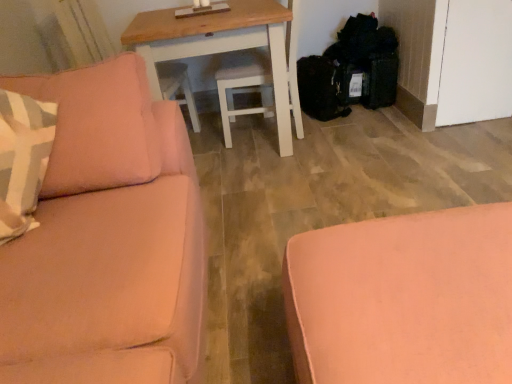
The height and width of the screenshot is (384, 512). Identify the location of satin pink couch at left, which appears as the second studio couch when viewed from the right. (106, 240).

This screenshot has width=512, height=384. Describe the element at coordinates (403, 299) in the screenshot. I see `pink fabric ottoman at lower right, acting as the second studio couch starting from the left` at that location.

Locate an element on the screen. pink fabric ottoman at lower right, acting as the second studio couch starting from the left is located at coordinates (403, 299).

What are the coordinates of `satin pink couch at left, which appears as the second studio couch when viewed from the right` in the screenshot? It's located at (106, 240).

Does pink fabric ottoman at lower right, the first studio couch from the right, have a smaller size compared to satin pink couch at left, which appears as the second studio couch when viewed from the right?

Indeed, pink fabric ottoman at lower right, the first studio couch from the right, has a smaller size compared to satin pink couch at left, which appears as the second studio couch when viewed from the right.

In the scene shown: How distant is pink fabric ottoman at lower right, acting as the second studio couch starting from the left, from satin pink couch at left, marked as the first studio couch in a left-to-right arrangement?

The distance of pink fabric ottoman at lower right, acting as the second studio couch starting from the left, from satin pink couch at left, marked as the first studio couch in a left-to-right arrangement, is 18.73 inches.

Which of these two, pink fabric ottoman at lower right, acting as the second studio couch starting from the left, or satin pink couch at left, which appears as the second studio couch when viewed from the right, stands shorter?

Standing shorter between the two is pink fabric ottoman at lower right, acting as the second studio couch starting from the left.

Image resolution: width=512 pixels, height=384 pixels. There is a pink fabric ottoman at lower right, the first studio couch from the right. Identify the location of studio couch above it (from a real-world perspective). (106, 240).

Between satin pink couch at left, marked as the first studio couch in a left-to-right arrangement, and wooden table at center, which one appears on the left side from the viewer's perspective?

satin pink couch at left, marked as the first studio couch in a left-to-right arrangement, is more to the left.

Consider the image. Which is in front, satin pink couch at left, which appears as the second studio couch when viewed from the right, or wooden table at center?

Positioned in front is satin pink couch at left, which appears as the second studio couch when viewed from the right.

Can you confirm if satin pink couch at left, which appears as the second studio couch when viewed from the right, is taller than wooden table at center?

Yes, satin pink couch at left, which appears as the second studio couch when viewed from the right, is taller than wooden table at center.

Is satin pink couch at left, marked as the first studio couch in a left-to-right arrangement, facing away from pink fabric ottoman at lower right, the first studio couch from the right?

→ No, pink fabric ottoman at lower right, the first studio couch from the right, is not at the back of satin pink couch at left, marked as the first studio couch in a left-to-right arrangement.

How distant is satin pink couch at left, marked as the first studio couch in a left-to-right arrangement, from pink fabric ottoman at lower right, acting as the second studio couch starting from the left?

satin pink couch at left, marked as the first studio couch in a left-to-right arrangement, is 18.73 inches away from pink fabric ottoman at lower right, acting as the second studio couch starting from the left.

Considering the relative positions of satin pink couch at left, marked as the first studio couch in a left-to-right arrangement, and pink fabric ottoman at lower right, acting as the second studio couch starting from the left, in the image provided, is satin pink couch at left, marked as the first studio couch in a left-to-right arrangement, in front of pink fabric ottoman at lower right, acting as the second studio couch starting from the left,?

Yes, the depth of satin pink couch at left, marked as the first studio couch in a left-to-right arrangement, is less than that of pink fabric ottoman at lower right, acting as the second studio couch starting from the left.

Does satin pink couch at left, which appears as the second studio couch when viewed from the right, have a larger size compared to pink fabric ottoman at lower right, acting as the second studio couch starting from the left?

Yes.

From a real-world perspective, who is located higher, pink fabric ottoman at lower right, the first studio couch from the right, or wooden table at center?

From a 3D spatial view, wooden table at center is above.

Is pink fabric ottoman at lower right, the first studio couch from the right, facing away from wooden table at center?

pink fabric ottoman at lower right, the first studio couch from the right, does not have its back to wooden table at center.

Where is `studio couch that appears below the wooden table at center (from a real-world perspective)`? The image size is (512, 384). studio couch that appears below the wooden table at center (from a real-world perspective) is located at coordinates (403, 299).

In terms of width, does wooden table at center look wider or thinner when compared to pink fabric ottoman at lower right, the first studio couch from the right?

Clearly, wooden table at center has more width compared to pink fabric ottoman at lower right, the first studio couch from the right.

In the scene shown: Can you confirm if wooden table at center is smaller than pink fabric ottoman at lower right, the first studio couch from the right?

No, wooden table at center is not smaller than pink fabric ottoman at lower right, the first studio couch from the right.

Looking at this image, from a real-world perspective, which is physically below, wooden table at center or pink fabric ottoman at lower right, the first studio couch from the right?

pink fabric ottoman at lower right, the first studio couch from the right, is physically lower.

From the image's perspective, between wooden table at center and pink fabric ottoman at lower right, the first studio couch from the right, who is located below?

pink fabric ottoman at lower right, the first studio couch from the right, is shown below in the image.

Are wooden table at center and satin pink couch at left, marked as the first studio couch in a left-to-right arrangement, located far from each other?

Absolutely, wooden table at center is distant from satin pink couch at left, marked as the first studio couch in a left-to-right arrangement.

Is wooden table at center not inside satin pink couch at left, marked as the first studio couch in a left-to-right arrangement?

Yes, wooden table at center is outside of satin pink couch at left, marked as the first studio couch in a left-to-right arrangement.

What's the angular difference between wooden table at center and satin pink couch at left, marked as the first studio couch in a left-to-right arrangement,'s facing directions?

2.82 degrees separate the facing orientations of wooden table at center and satin pink couch at left, marked as the first studio couch in a left-to-right arrangement.

From a real-world perspective, who is located higher, wooden table at center or satin pink couch at left, which appears as the second studio couch when viewed from the right?

satin pink couch at left, which appears as the second studio couch when viewed from the right, from a real-world perspective.

Find the location of `studio couch in front of the pink fabric ottoman at lower right, the first studio couch from the right`. studio couch in front of the pink fabric ottoman at lower right, the first studio couch from the right is located at coordinates (106, 240).

What are the coordinates of `table below the satin pink couch at left, which appears as the second studio couch when viewed from the right (from a real-world perspective)` in the screenshot? It's located at (219, 45).

From the image, which object appears to be farther from satin pink couch at left, marked as the first studio couch in a left-to-right arrangement, pink fabric ottoman at lower right, acting as the second studio couch starting from the left, or wooden table at center?

wooden table at center.

Considering their positions, is wooden table at center positioned closer to satin pink couch at left, which appears as the second studio couch when viewed from the right, than pink fabric ottoman at lower right, the first studio couch from the right?

The object closer to satin pink couch at left, which appears as the second studio couch when viewed from the right, is pink fabric ottoman at lower right, the first studio couch from the right.

When comparing their distances from wooden table at center, does pink fabric ottoman at lower right, the first studio couch from the right, or satin pink couch at left, marked as the first studio couch in a left-to-right arrangement, seem closer?

satin pink couch at left, marked as the first studio couch in a left-to-right arrangement.

Considering their positions, is wooden table at center positioned further to pink fabric ottoman at lower right, acting as the second studio couch starting from the left, than satin pink couch at left, which appears as the second studio couch when viewed from the right?

wooden table at center.

From the image, which object appears to be farther from wooden table at center, satin pink couch at left, which appears as the second studio couch when viewed from the right, or pink fabric ottoman at lower right, the first studio couch from the right?

pink fabric ottoman at lower right, the first studio couch from the right, is further to wooden table at center.

Based on their spatial positions, is satin pink couch at left, which appears as the second studio couch when viewed from the right, or wooden table at center closer to pink fabric ottoman at lower right, the first studio couch from the right?

satin pink couch at left, which appears as the second studio couch when viewed from the right, is closer to pink fabric ottoman at lower right, the first studio couch from the right.

This screenshot has height=384, width=512. Find the location of `studio couch located between satin pink couch at left, which appears as the second studio couch when viewed from the right, and wooden table at center in the depth direction`. studio couch located between satin pink couch at left, which appears as the second studio couch when viewed from the right, and wooden table at center in the depth direction is located at coordinates (403, 299).